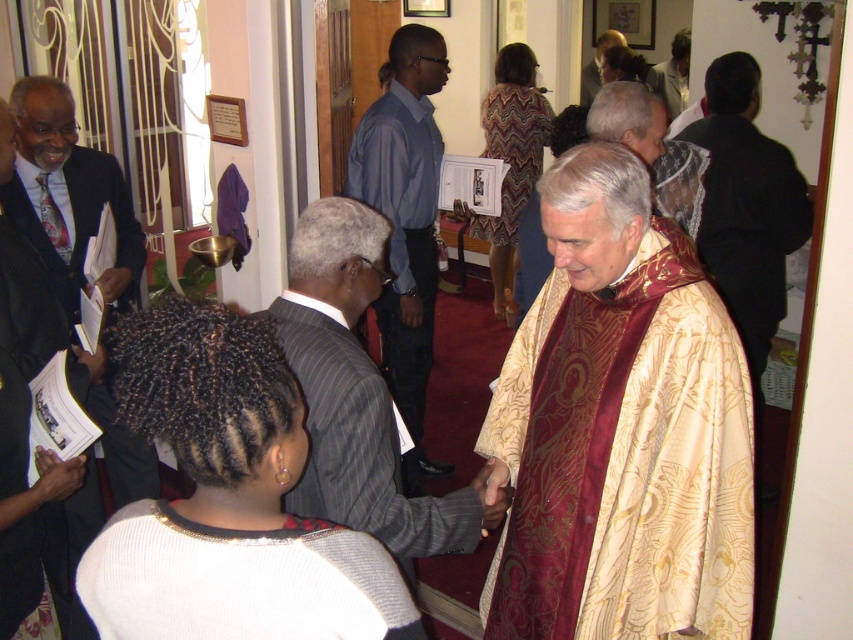
Locate an element on the screen. blue shirt at center is located at coordinates (405, 221).

In the scene shown: Between blue shirt at center and light brown leather jacket at upper center, which one has more height?

blue shirt at center

Which is behind, point (426, 352) or point (676, 42)?

Positioned behind is point (676, 42).

Where is `blue shirt at center`? blue shirt at center is located at coordinates (405, 221).

Who is positioned more to the left, dark suit at left or multicolored patterned dress at center?

dark suit at left

Between point (35, 81) and point (538, 92), which one is positioned in front?

Point (35, 81) is more forward.

Where is `dark suit at left`? dark suit at left is located at coordinates (57, 212).

At what (x,y) coordinates should I click in order to perform the action: click on gold brocade robe at center. Please return your answer as a coordinate pair (x, y). The height and width of the screenshot is (640, 853). Looking at the image, I should click on (624, 460).

What do you see at coordinates (624, 460) in the screenshot? Image resolution: width=853 pixels, height=640 pixels. I see `gold brocade robe at center` at bounding box center [624, 460].

Is point (671, 618) positioned after point (227, 566)?

Yes, point (671, 618) is farther from viewer.

I want to click on gold brocade robe at center, so click(x=624, y=460).